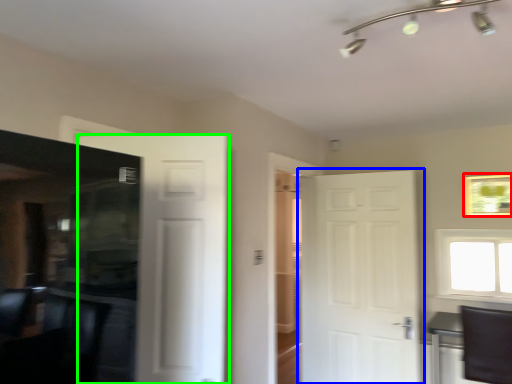
Question: Which is farther away from picture frame (highlighted by a red box)? door (highlighted by a blue box) or door (highlighted by a green box)?

Choices:
 (A) door
 (B) door

Answer: (B)